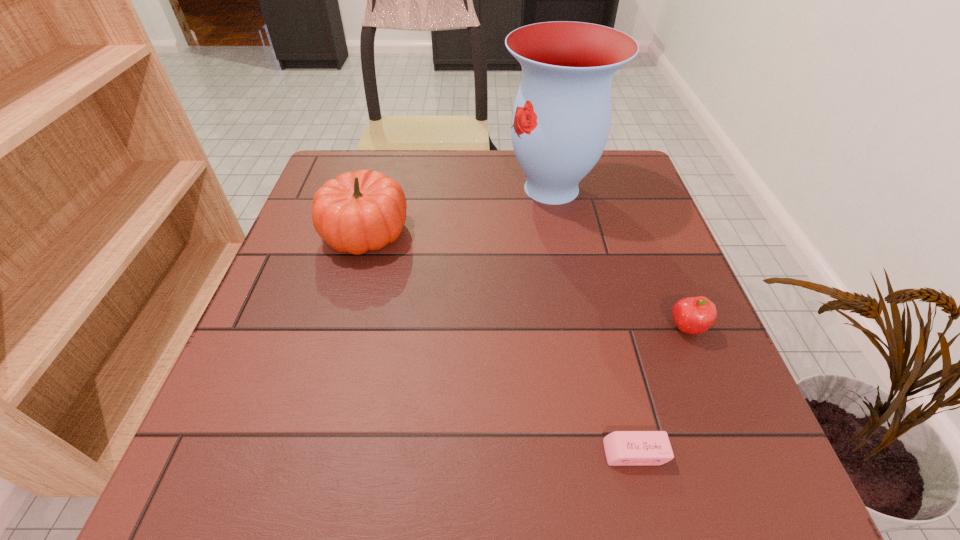
Image resolution: width=960 pixels, height=540 pixels. In order to click on free space at the near edge of the desktop in this screenshot , I will do `click(582, 447)`.

Find the location of a particular element. vacant area at the left edge is located at coordinates (223, 413).

In the image, there is a desktop. Identify the location of free space at the right edge. (656, 252).

Locate an element on the screen. vacant space at the far left corner of the desktop is located at coordinates (377, 163).

Find the location of a particular element. This screenshot has height=540, width=960. vacant space at the far right corner is located at coordinates (584, 187).

Where is `free spot between the rightmost object and the eraser`? The height and width of the screenshot is (540, 960). free spot between the rightmost object and the eraser is located at coordinates (660, 390).

At what (x,y) coordinates should I click in order to perform the action: click on free spot between the shortest object and the vase. Please return your answer as a coordinate pair (x, y). This screenshot has height=540, width=960. Looking at the image, I should click on (593, 320).

What are the coordinates of `unoccupied area between the apple and the vase` in the screenshot? It's located at (619, 258).

Identify the location of free space between the rightmost object and the eraser. The width and height of the screenshot is (960, 540). click(660, 390).

Where is `free area in between the third tallest object and the nearest object`? The width and height of the screenshot is (960, 540). free area in between the third tallest object and the nearest object is located at coordinates (660, 390).